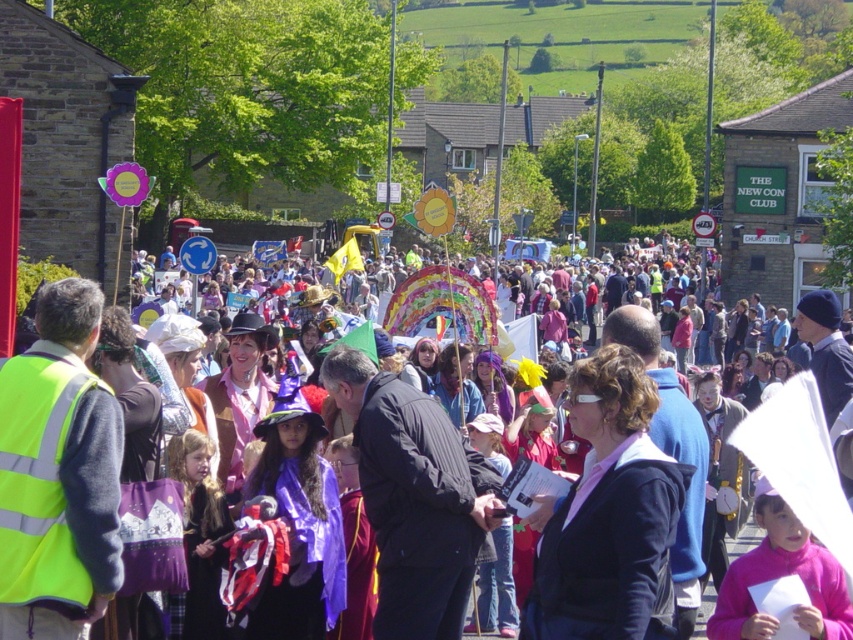
Question: Observing the image, what is the correct spatial positioning of matte purple costume at center in reference to pink fabric at center?

Choices:
 (A) left
 (B) right

Answer: (B)

Question: Can you confirm if matte purple costume at center is smaller than pink fabric at center?

Choices:
 (A) no
 (B) yes

Answer: (A)

Question: Does matte purple costume at center have a lesser width compared to pink fabric at center?

Choices:
 (A) no
 (B) yes

Answer: (A)

Question: Which point appears closest to the camera in this image?

Choices:
 (A) (721, 406)
 (B) (556, 576)

Answer: (B)